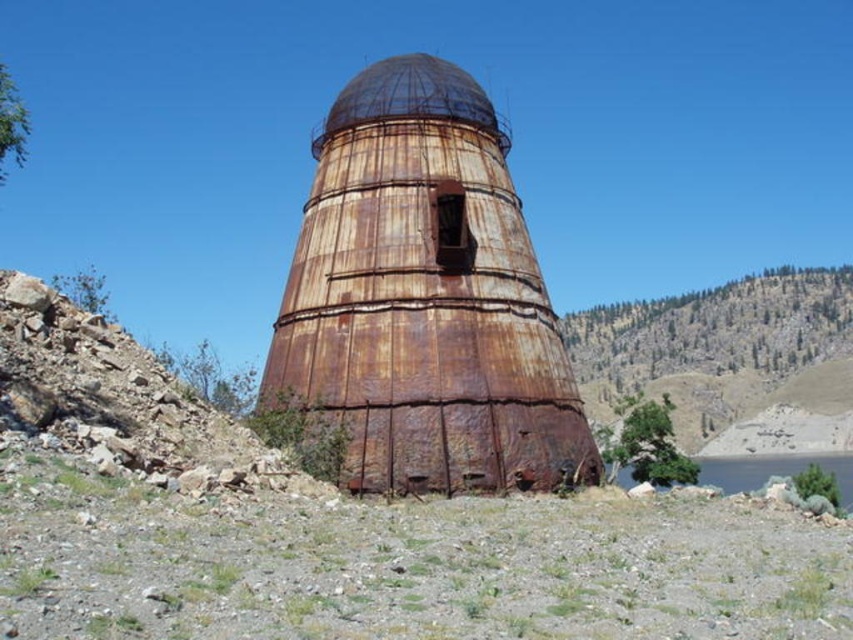
You are standing at the base of the silo and want to climb to the top of the rusty metal dome at center. There is a ladder attached to the green grassy hillside at upper center. Can you use the ladder to reach the dome?

The green grassy hillside at upper center is much taller than the rusty metal dome at center, so the ladder on the hillside is higher up and would not allow you to reach the dome from the base of the silo.

You are a surveyor measuring distances between landmarks. You have a drone that can fly 500 feet. You need to fly from the rusty metal dome at center to the green grassy lake at lower right. Will your drone have enough battery to make the trip?

The distance between the rusty metal dome at center and the green grassy lake at lower right is 491.18 feet. Since the drone can fly 500 feet, it has enough battery to make the trip.